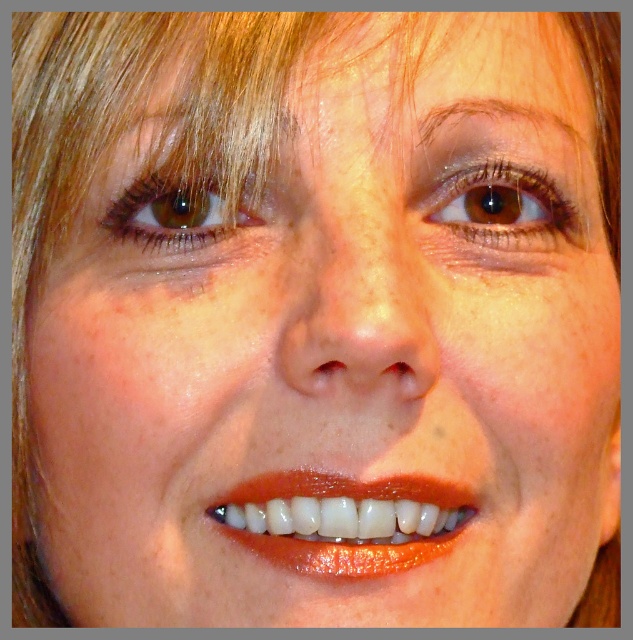
You are a photographer adjusting the focus on a camera. You have two points in the image to focus on, point 1 at point (339, 538) and point 2 at point (460, 211). Which point should you focus on first if you want to ensure the closest object is in focus?

Point 1 at point (339, 538) is closer to the viewer than point 2 at point (460, 211), so you should focus on point 1 first to ensure the closest object is in focus.

You are a dentist examining a patient and notice two features in the mouth area. The glossy white teeth at center and the brown matte eye at upper left. Which feature is located to the right of the other?

The glossy white teeth at center are positioned on the right side of the brown matte eye at upper left.